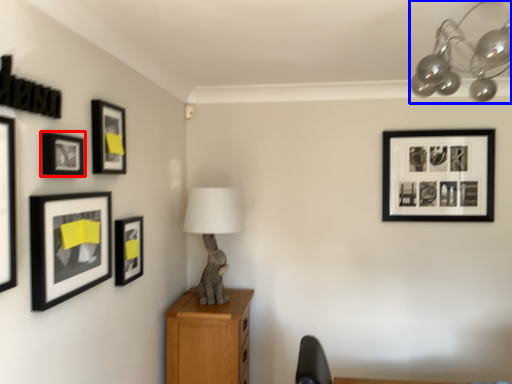
Question: Which object is closer to the camera taking this photo, picture frame (highlighted by a red box) or lamp (highlighted by a blue box)?

Choices:
 (A) picture frame
 (B) lamp

Answer: (B)